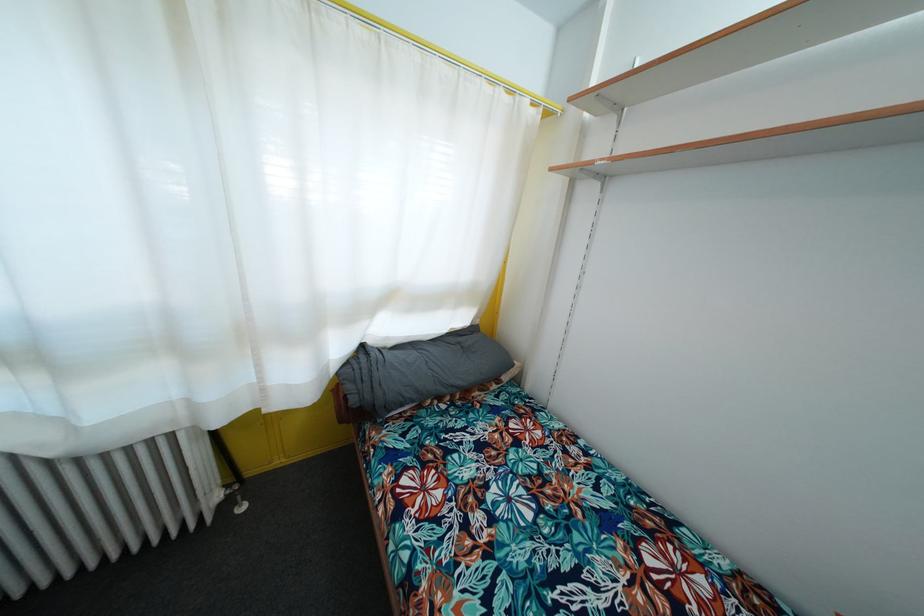
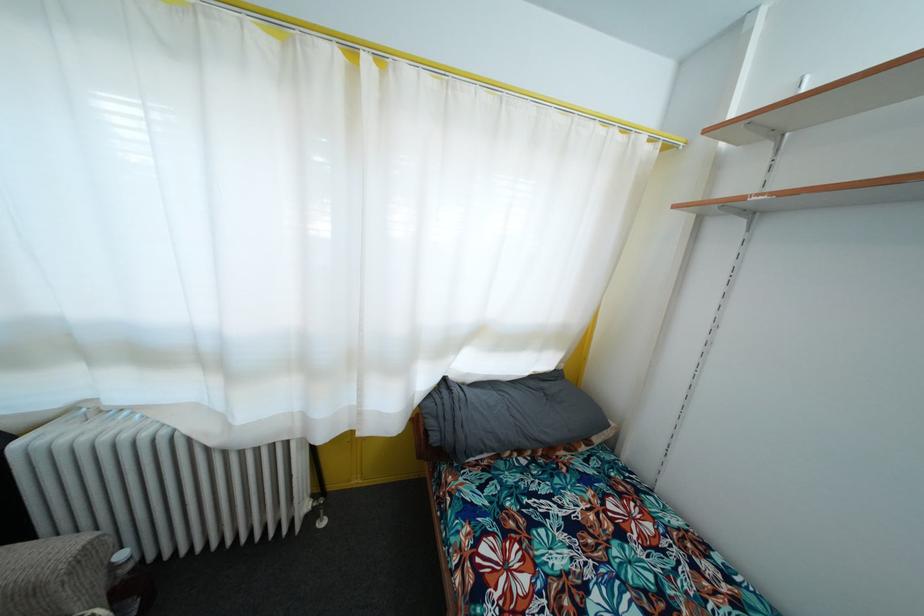
Question: What movement of the cameraman would produce the second image?

Choices:
 (A) Left
 (B) Right
 (C) Forward
 (D) Backward

Answer: (A)